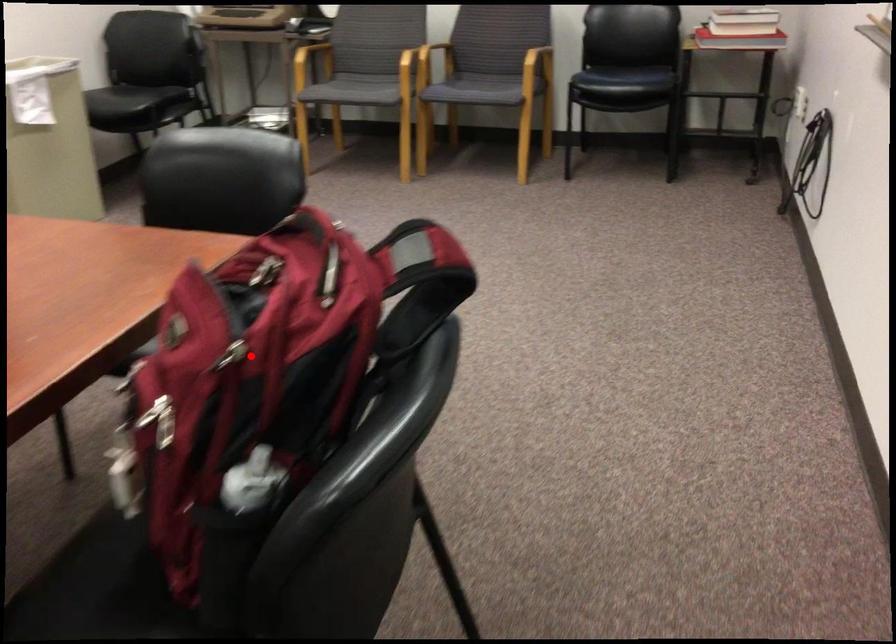
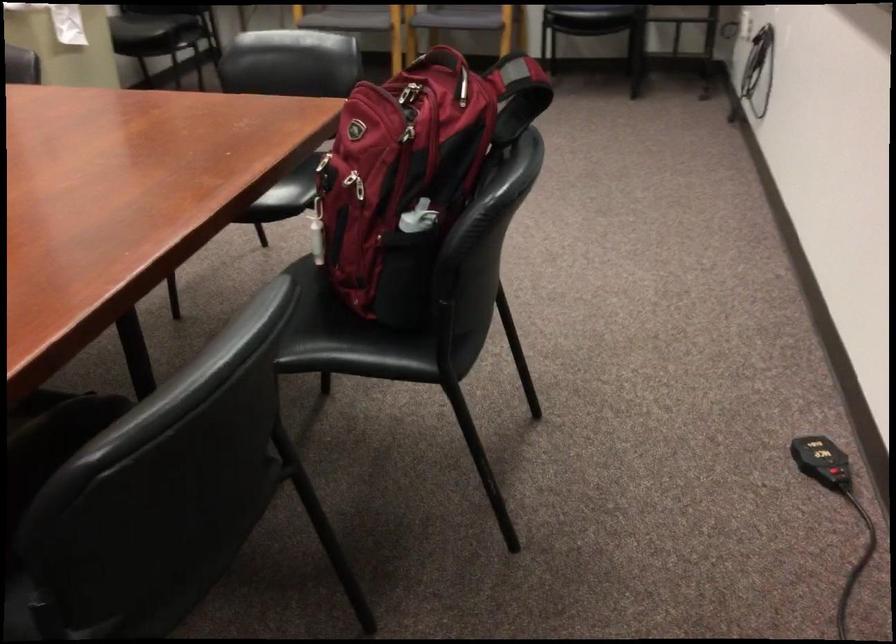
Where in the second image is the point corresponding to the highlighted location from the first image?

(412, 136)